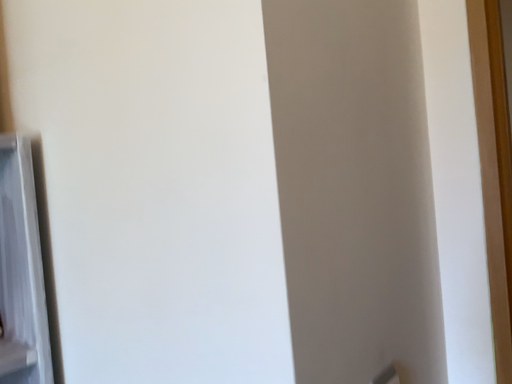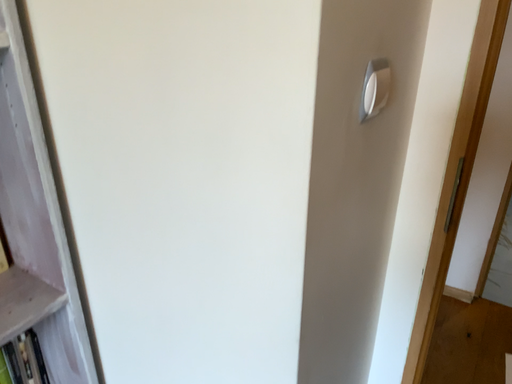
Question: Which way did the camera rotate in the video?

Choices:
 (A) rotated left
 (B) rotated right

Answer: (B)